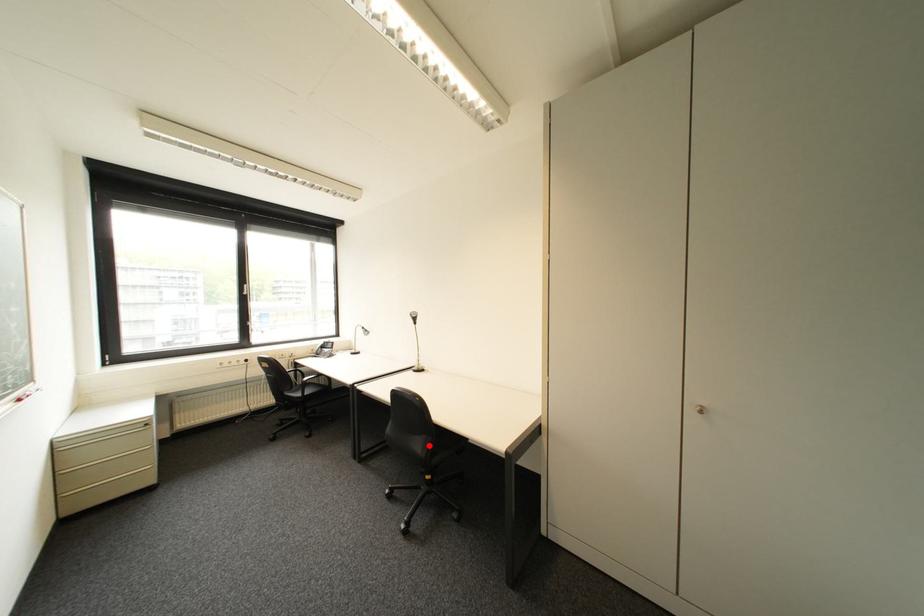
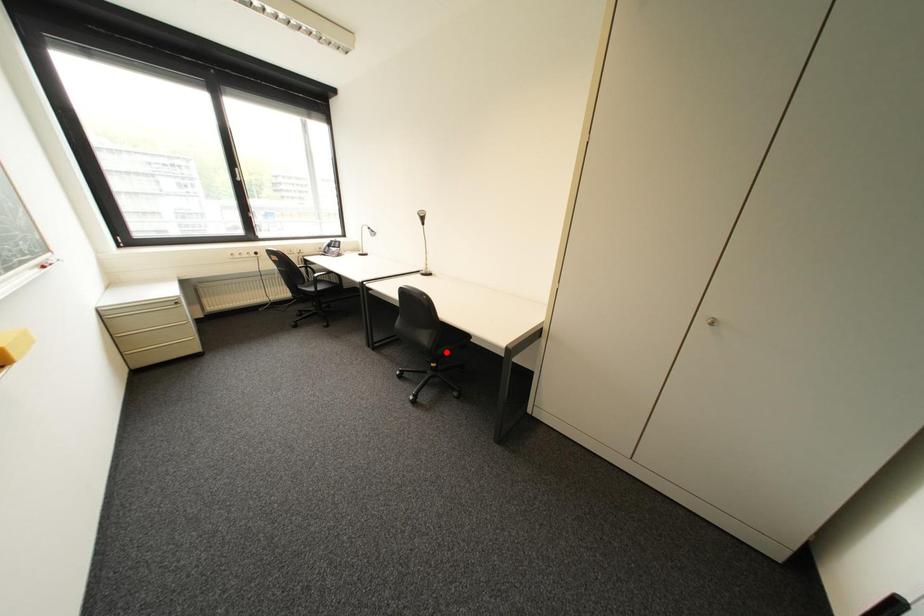
I am providing you with two images of the same scene from different viewpoints. A red point is marked on the first image and another point is marked on the second image. Is the red point in image1 aligned with the point shown in image2?

No